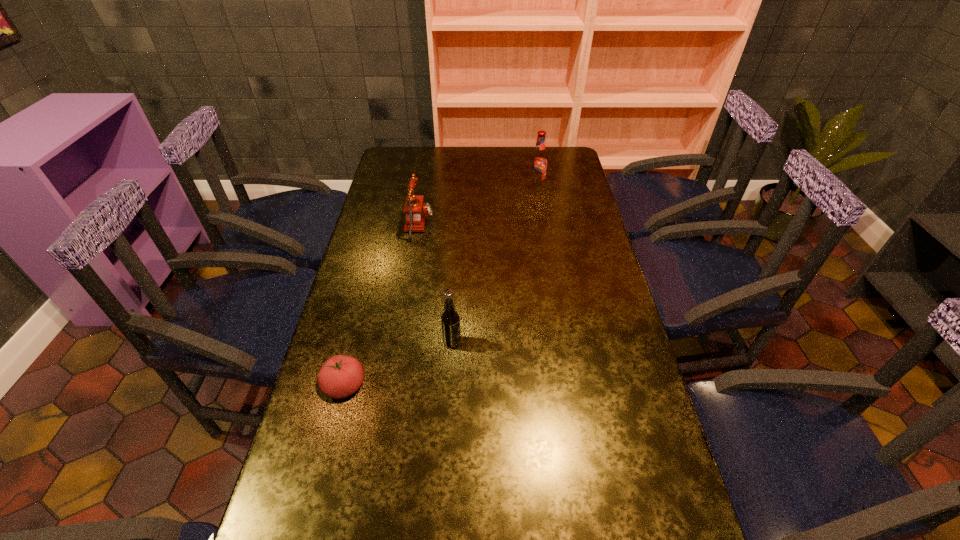
Find the location of a particular element. The height and width of the screenshot is (540, 960). vacant area situated 0.260m on the dial of the third nearest object is located at coordinates (504, 225).

Where is `vacant space situated 0.360m on the back of the shortest object`? vacant space situated 0.360m on the back of the shortest object is located at coordinates (373, 274).

Locate an element on the screen. telephone at the left edge is located at coordinates (416, 211).

This screenshot has width=960, height=540. In order to click on tomato that is at the left edge in this screenshot , I will do `click(341, 376)`.

You are a GUI agent. You are given a task and a screenshot of the screen. Output one action in this format:
    pyautogui.click(x=<x>, y=<y>)
    Task: Click on the object positioned at the right edge
    
    Given the screenshot: What is the action you would take?
    pyautogui.click(x=538, y=166)

The height and width of the screenshot is (540, 960). I want to click on free space at the far edge of the desktop, so click(x=513, y=160).

Where is `vacant area at the left edge of the desktop`? This screenshot has height=540, width=960. vacant area at the left edge of the desktop is located at coordinates (383, 269).

In the image, there is a desktop. Where is `vacant space at the right edge`? This screenshot has height=540, width=960. vacant space at the right edge is located at coordinates (589, 217).

Identify the location of free spot between the nearest object and the left root beer. This screenshot has height=540, width=960. (398, 364).

The image size is (960, 540). Find the location of `blank region between the third shortest object and the nearest object`. blank region between the third shortest object and the nearest object is located at coordinates click(398, 364).